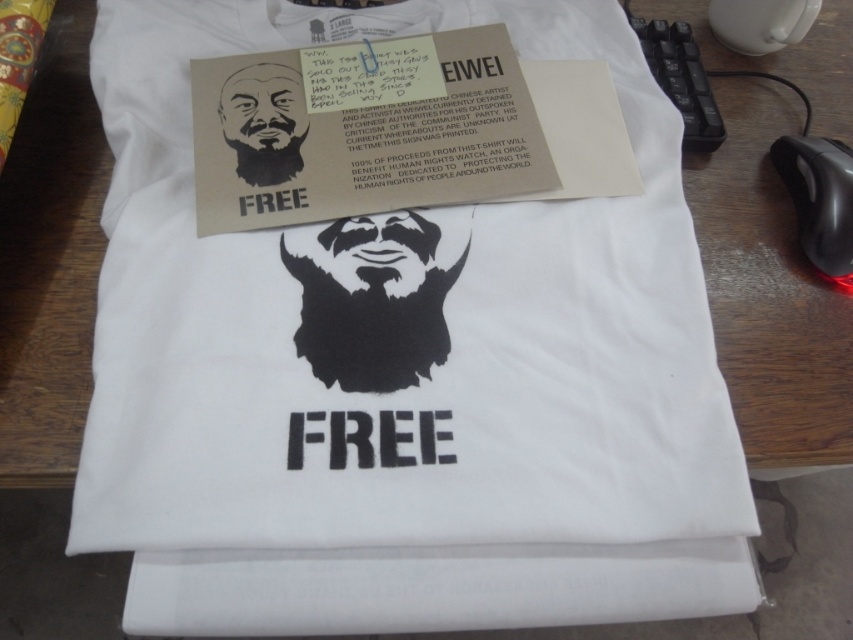
Question: Where is white matte t-shirt at center located in relation to black plastic mouse at lower right in the image?

Choices:
 (A) left
 (B) right

Answer: (A)

Question: Which point is farther from the camera taking this photo?

Choices:
 (A) (842, 214)
 (B) (637, 355)

Answer: (A)

Question: Which point is farther from the camera taking this photo?

Choices:
 (A) (790, 193)
 (B) (585, 355)

Answer: (A)

Question: Among these points, which one is farthest from the camera?

Choices:
 (A) (825, 156)
 (B) (460, 340)

Answer: (A)

Question: Is white matte t-shirt at center smaller than black plastic mouse at lower right?

Choices:
 (A) no
 (B) yes

Answer: (A)

Question: In this image, where is white matte t-shirt at center located relative to black plastic mouse at lower right?

Choices:
 (A) above
 (B) below

Answer: (B)